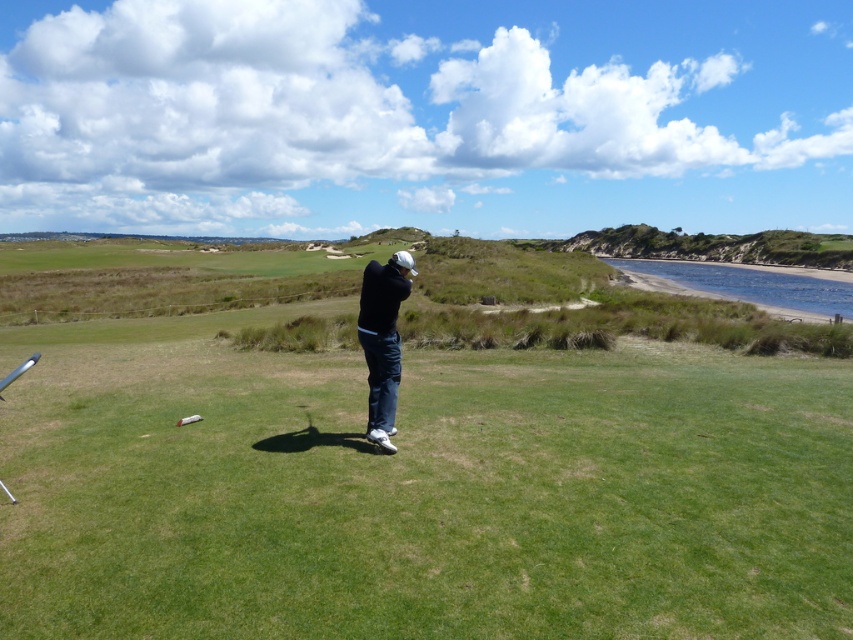
How distant is green grass at center from black matte jacket at center?

green grass at center and black matte jacket at center are 19.32 meters apart.

From the picture: Can you confirm if green grass at center is positioned to the right of black matte jacket at center?

Result: Incorrect, green grass at center is not on the right side of black matte jacket at center.

Who is more forward, (520, 545) or (404, 275)?

Point (520, 545) is in front.

The image size is (853, 640). Find the location of `green grass at center`. green grass at center is located at coordinates pyautogui.click(x=401, y=467).